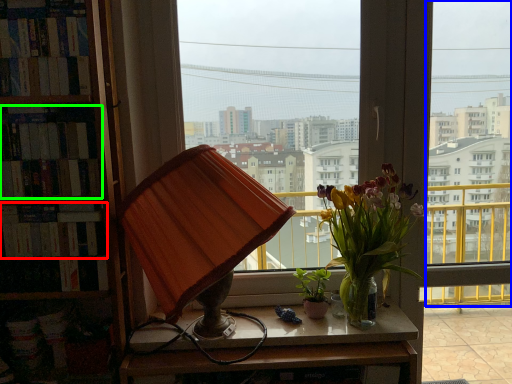
Question: Which object is positioned farthest from book (highlighted by a red box)? Select from window (highlighted by a blue box) and book (highlighted by a green box).

Choices:
 (A) window
 (B) book

Answer: (A)